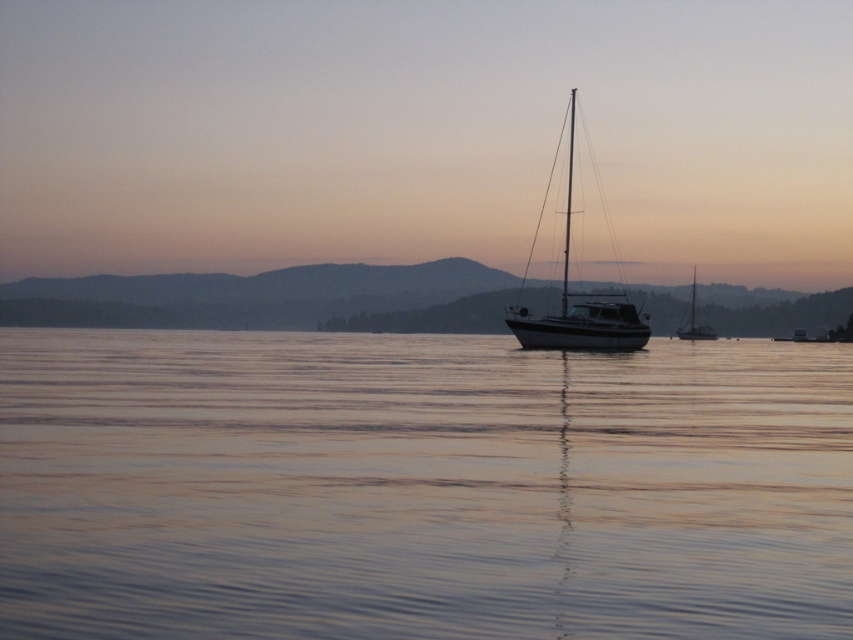
Who is more forward, (338,388) or (694,278)?

Point (338,388)

This screenshot has width=853, height=640. In order to click on smooth water at center in this screenshot , I will do `click(421, 486)`.

Is point (38, 544) less distant than point (693, 294)?

Yes, it is.

Where is `smooth water at center`? smooth water at center is located at coordinates (421, 486).

Can you confirm if shiny white sailboat at center is wider than shiny silver sailboat at right?

Correct, the width of shiny white sailboat at center exceeds that of shiny silver sailboat at right.

Who is positioned more to the right, shiny white sailboat at center or shiny silver sailboat at right?

From the viewer's perspective, shiny silver sailboat at right appears more on the right side.

Who is more distant from viewer, (578, 339) or (704, 333)?

Positioned behind is point (704, 333).

You are a GUI agent. You are given a task and a screenshot of the screen. Output one action in this format:
    pyautogui.click(x=<x>, y=<y>)
    Task: Click on the shiny white sailboat at center
    The height and width of the screenshot is (640, 853).
    Given the screenshot: What is the action you would take?
    pyautogui.click(x=576, y=292)

Is smooth water at center smaller than shiny white sailboat at center?

Correct, smooth water at center occupies less space than shiny white sailboat at center.

Does point (49, 611) come closer to viewer compared to point (556, 154)?

Yes, point (49, 611) is in front of point (556, 154).

Measure the distance between smooth water at center and camera.

A distance of 7.53 meters exists between smooth water at center and camera.

The height and width of the screenshot is (640, 853). I want to click on smooth water at center, so click(x=421, y=486).